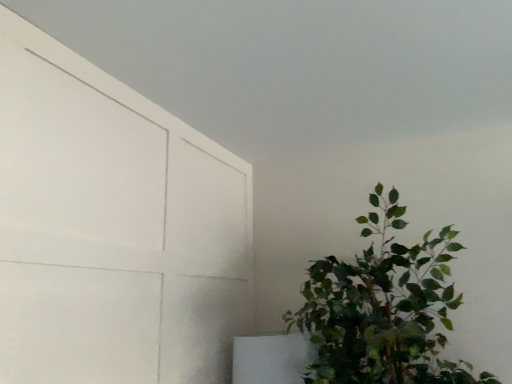
What is the approximate width of green leafy plant at right?

green leafy plant at right is 32.14 inches in width.

The height and width of the screenshot is (384, 512). I want to click on green leafy plant at right, so (383, 309).

What do you see at coordinates (383, 309) in the screenshot? I see `green leafy plant at right` at bounding box center [383, 309].

Locate an element on the screen. The width and height of the screenshot is (512, 384). green leafy plant at right is located at coordinates (383, 309).